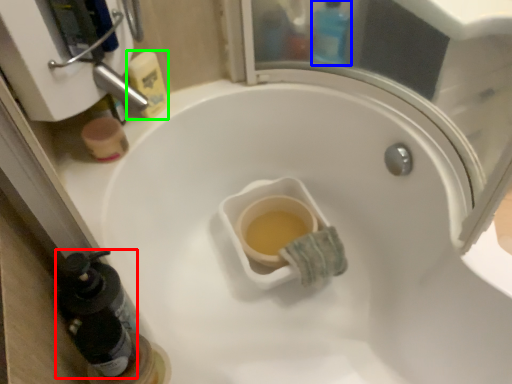
Question: Based on their relative distances, which object is nearer to bottle (highlighted by a red box)? Choose from bottle (highlighted by a blue box) and cleaning product (highlighted by a green box).

Choices:
 (A) bottle
 (B) cleaning product

Answer: (B)